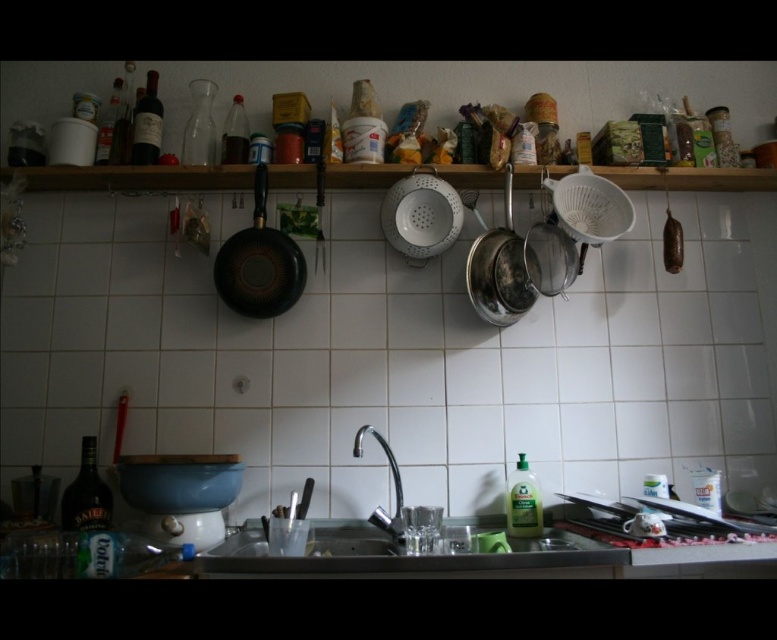
Does stainless steel sink at lower center have a greater height compared to black matte frying pan at upper left?

In fact, stainless steel sink at lower center may be shorter than black matte frying pan at upper left.

Can you confirm if stainless steel sink at lower center is positioned to the left of black matte frying pan at upper left?

In fact, stainless steel sink at lower center is to the right of black matte frying pan at upper left.

Where is `stainless steel sink at lower center`? The image size is (777, 640). stainless steel sink at lower center is located at coordinates click(401, 552).